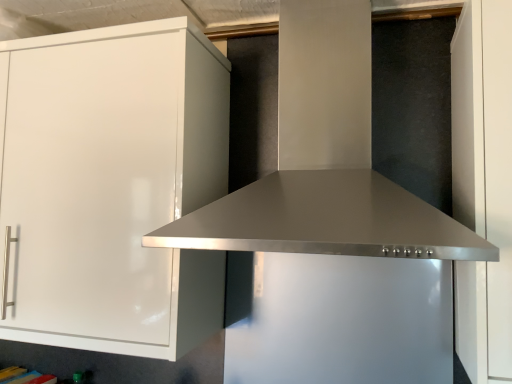
Describe the element at coordinates (325, 220) in the screenshot. I see `stainless steel vent at center` at that location.

Locate an element on the screen. The width and height of the screenshot is (512, 384). stainless steel vent at center is located at coordinates (325, 220).

Locate an element on the screen. This screenshot has height=384, width=512. white glossy cabinet at left is located at coordinates [110, 186].

The height and width of the screenshot is (384, 512). What do you see at coordinates (110, 186) in the screenshot? I see `white glossy cabinet at left` at bounding box center [110, 186].

You are a GUI agent. You are given a task and a screenshot of the screen. Output one action in this format:
    pyautogui.click(x=<x>, y=<y>)
    Task: Click on the stainless steel vent at center
    The image size is (512, 384).
    Given the screenshot: What is the action you would take?
    pyautogui.click(x=325, y=220)

Considering the positions of objects stainless steel vent at center and white glossy cabinet at left in the image provided, who is more to the left, stainless steel vent at center or white glossy cabinet at left?

Positioned to the left is white glossy cabinet at left.

Is stainless steel vent at center in front of or behind white glossy cabinet at left in the image?

In the image, stainless steel vent at center appears in front of white glossy cabinet at left.

Which is in front, point (304, 220) or point (20, 134)?

The point (304, 220) is in front.

From the image's perspective, which one is positioned higher, stainless steel vent at center or white glossy cabinet at left?

stainless steel vent at center is shown above in the image.

From a real-world perspective, is stainless steel vent at center positioned above or below white glossy cabinet at left?

stainless steel vent at center is situated higher than white glossy cabinet at left in the real world.

Considering the sizes of objects stainless steel vent at center and white glossy cabinet at left in the image provided, who is thinner, stainless steel vent at center or white glossy cabinet at left?

Thinner between the two is white glossy cabinet at left.

Between stainless steel vent at center and white glossy cabinet at left, which one has more height?

white glossy cabinet at left is taller.

Can you confirm if stainless steel vent at center is smaller than white glossy cabinet at left?

Yes.

Is white glossy cabinet at left located within stainless steel vent at center?

No, white glossy cabinet at left is not inside stainless steel vent at center.

Consider the image. Is stainless steel vent at center placed right next to white glossy cabinet at left?

stainless steel vent at center is not next to white glossy cabinet at left, and they're not touching.

Could you tell me if stainless steel vent at center is facing white glossy cabinet at left?

No.

Measure the distance from stainless steel vent at center to white glossy cabinet at left.

stainless steel vent at center and white glossy cabinet at left are 12.68 inches apart from each other.

You are a GUI agent. You are given a task and a screenshot of the screen. Output one action in this format:
    pyautogui.click(x=<x>, y=<y>)
    Task: Click on the cabinetry lying behind the stainless steel vent at center
    The image size is (512, 384).
    Given the screenshot: What is the action you would take?
    pyautogui.click(x=110, y=186)

In the scene shown: Considering the positions of objects white glossy cabinet at left and stainless steel vent at center in the image provided, who is more to the left, white glossy cabinet at left or stainless steel vent at center?

white glossy cabinet at left.

Is white glossy cabinet at left positioned before stainless steel vent at center?

That is False.

Is point (87, 346) farther from viewer compared to point (203, 218)?

Yes, it is behind point (203, 218).

From the image's perspective, who appears lower, white glossy cabinet at left or stainless steel vent at center?

From the image's view, white glossy cabinet at left is below.

From a real-world perspective, is white glossy cabinet at left located beneath stainless steel vent at center?

Yes, from a real-world perspective, white glossy cabinet at left is under stainless steel vent at center.

Between white glossy cabinet at left and stainless steel vent at center, which one has larger width?

With larger width is stainless steel vent at center.

Between white glossy cabinet at left and stainless steel vent at center, which one has less height?

Standing shorter between the two is stainless steel vent at center.

Considering the relative sizes of white glossy cabinet at left and stainless steel vent at center in the image provided, is white glossy cabinet at left smaller than stainless steel vent at center?

Actually, white glossy cabinet at left might be larger than stainless steel vent at center.

Is white glossy cabinet at left outside of stainless steel vent at center?

Yes.

Can you see white glossy cabinet at left touching stainless steel vent at center?

white glossy cabinet at left is not next to stainless steel vent at center, and they're not touching.

Is white glossy cabinet at left oriented towards stainless steel vent at center?

No, white glossy cabinet at left is not oriented towards stainless steel vent at center.

Where is `cabinetry below the stainless steel vent at center (from the image's perspective)`? This screenshot has height=384, width=512. cabinetry below the stainless steel vent at center (from the image's perspective) is located at coordinates (110, 186).

What are the coordinates of `cabinetry on the left of stainless steel vent at center` in the screenshot? It's located at (110, 186).

The height and width of the screenshot is (384, 512). Identify the location of cabinetry located underneath the stainless steel vent at center (from a real-world perspective). (110, 186).